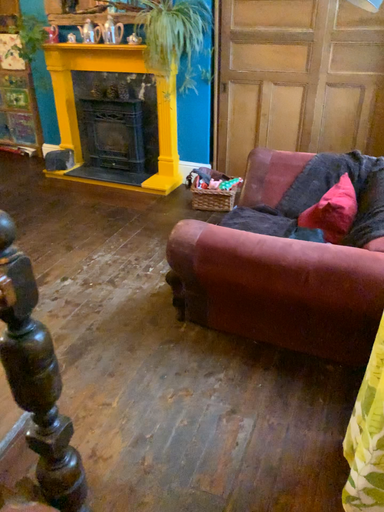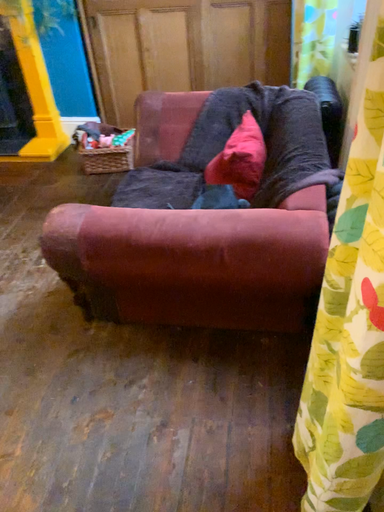
Question: How did the camera likely rotate when shooting the video?

Choices:
 (A) rotated left
 (B) rotated right

Answer: (B)